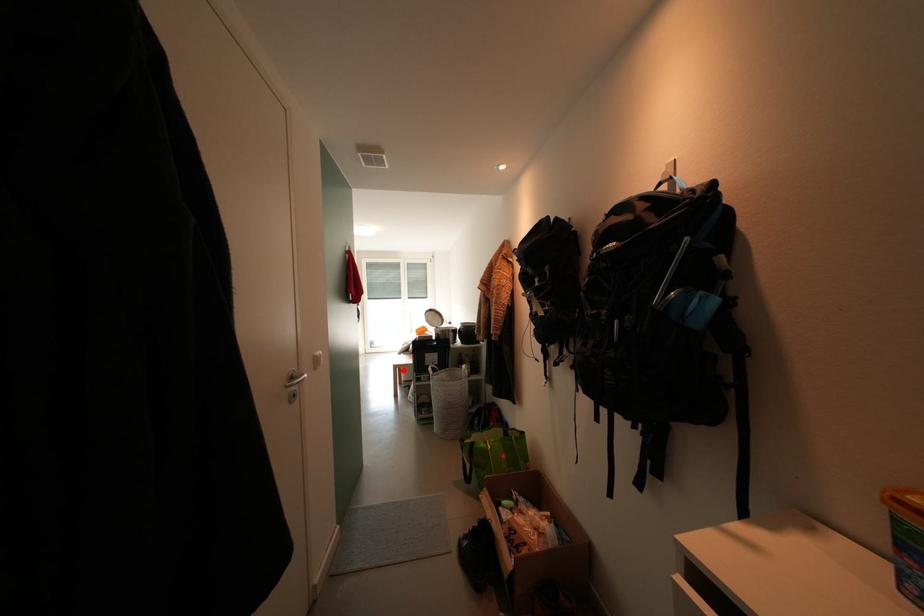
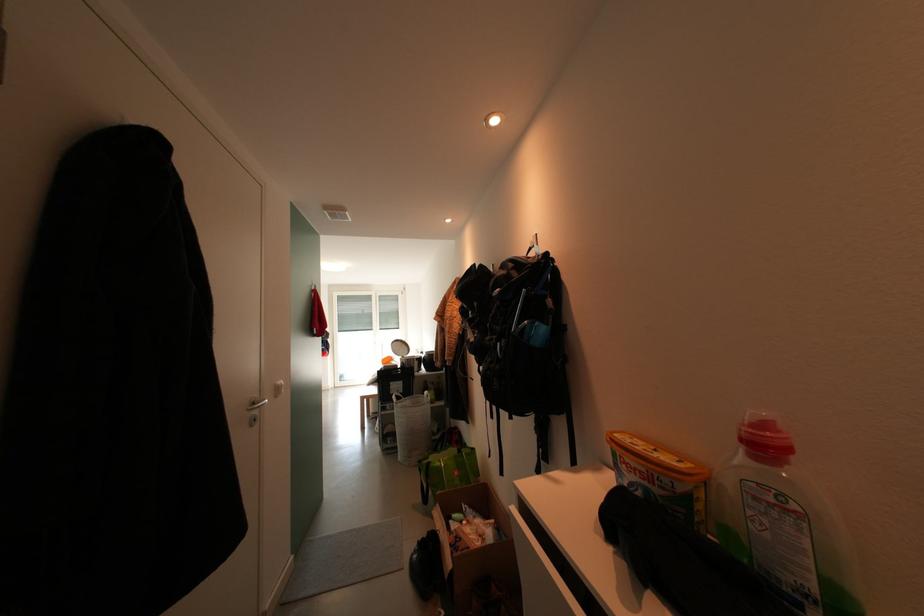
Locate, in the second image, the point that corresponds to the highlighted location in the first image.

(371, 400)